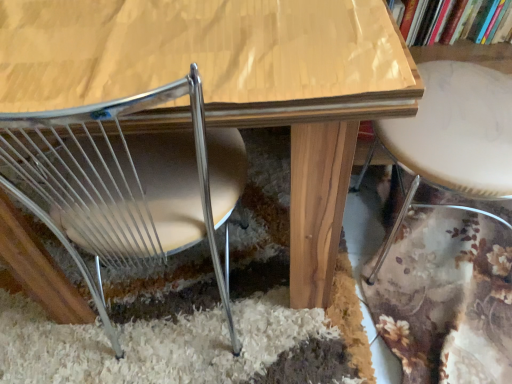
Question: Is wooden table at center at the right side of hardcover book at upper right?

Choices:
 (A) yes
 (B) no

Answer: (B)

Question: Considering the relative sizes of wooden table at center and hardcover book at upper right in the image provided, is wooden table at center wider than hardcover book at upper right?

Choices:
 (A) no
 (B) yes

Answer: (B)

Question: Does wooden table at center lie in front of hardcover book at upper right?

Choices:
 (A) no
 (B) yes

Answer: (B)

Question: Does wooden table at center contain hardcover book at upper right?

Choices:
 (A) yes
 (B) no

Answer: (B)

Question: Can we say wooden table at center lies outside hardcover book at upper right?

Choices:
 (A) no
 (B) yes

Answer: (B)

Question: From the image's perspective, is wooden table at center on hardcover book at upper right?

Choices:
 (A) yes
 (B) no

Answer: (B)

Question: Does hardcover book at upper right come behind metallic wire chair at lower left?

Choices:
 (A) yes
 (B) no

Answer: (A)

Question: From the image's perspective, is hardcover book at upper right on top of metallic wire chair at lower left?

Choices:
 (A) yes
 (B) no

Answer: (A)

Question: From the image's perspective, does hardcover book at upper right appear lower than metallic wire chair at lower left?

Choices:
 (A) yes
 (B) no

Answer: (B)

Question: Considering the relative sizes of hardcover book at upper right and metallic wire chair at lower left in the image provided, is hardcover book at upper right wider than metallic wire chair at lower left?

Choices:
 (A) no
 (B) yes

Answer: (A)

Question: Could you tell me if hardcover book at upper right is turned towards metallic wire chair at lower left?

Choices:
 (A) no
 (B) yes

Answer: (A)

Question: Is hardcover book at upper right touching metallic wire chair at lower left?

Choices:
 (A) no
 (B) yes

Answer: (A)

Question: Does white marble bar stool at right have a lesser height compared to hardcover book at upper right?

Choices:
 (A) yes
 (B) no

Answer: (B)